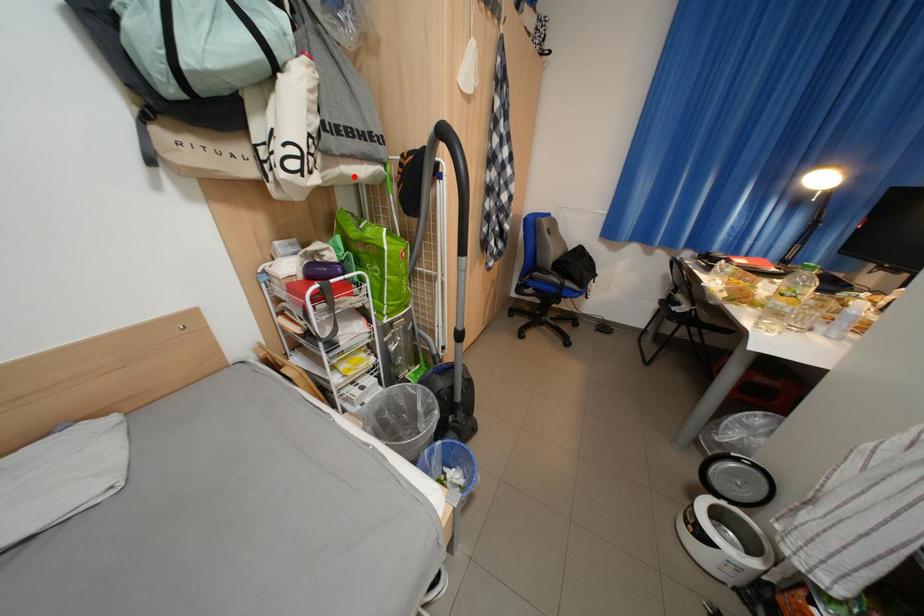
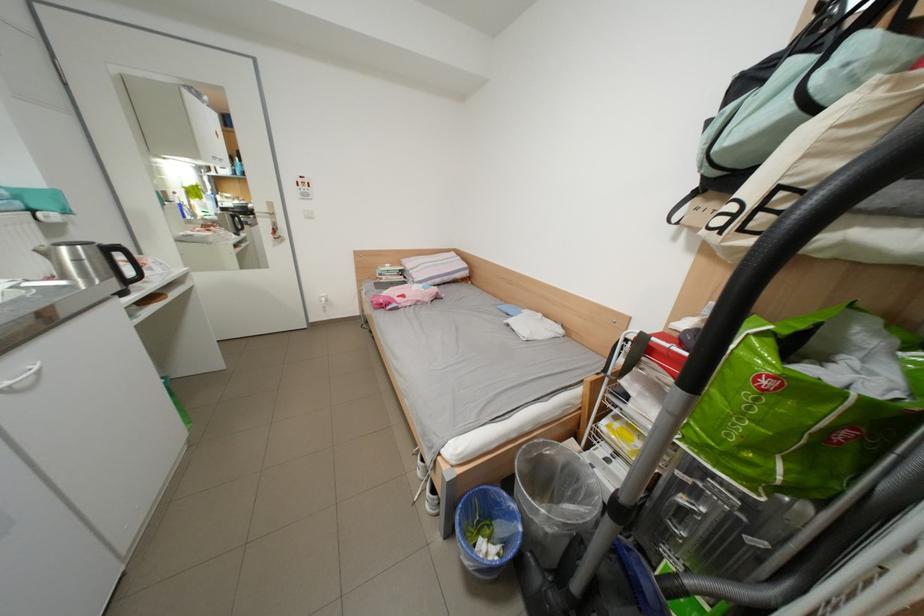
Question: A red point is marked in image1. In image2, is the corresponding 3D point closer to the camera or farther? Reply with the corresponding letter.

Choices:
 (A) The corresponding 3D point is closer.
 (B) The corresponding 3D point is farther.

Answer: (B)